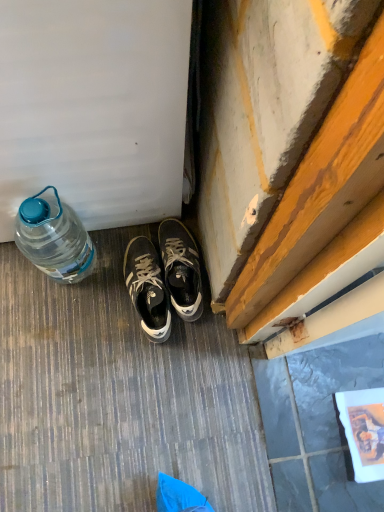
Question: Considering the relative positions of dark gray leather sneakers at center, which appears as the 1th sneakers when viewed from the left, and translucent plastic bottle at left in the image provided, is dark gray leather sneakers at center, which appears as the 1th sneakers when viewed from the left, in front of translucent plastic bottle at left?

Choices:
 (A) yes
 (B) no

Answer: (B)

Question: Considering the relative sizes of dark gray leather sneakers at center, the 2th sneakers when ordered from right to left, and translucent plastic bottle at left in the image provided, is dark gray leather sneakers at center, the 2th sneakers when ordered from right to left, taller than translucent plastic bottle at left?

Choices:
 (A) no
 (B) yes

Answer: (A)

Question: From the image's perspective, is dark gray leather sneakers at center, which appears as the 1th sneakers when viewed from the left, located above translucent plastic bottle at left?

Choices:
 (A) yes
 (B) no

Answer: (B)

Question: Can you confirm if dark gray leather sneakers at center, which appears as the 1th sneakers when viewed from the left, is positioned to the right of translucent plastic bottle at left?

Choices:
 (A) no
 (B) yes

Answer: (B)

Question: From a real-world perspective, is dark gray leather sneakers at center, the 2th sneakers when ordered from right to left, over translucent plastic bottle at left?

Choices:
 (A) yes
 (B) no

Answer: (B)

Question: Considering the relative positions of translucent plastic bottle at left and matte black sneakers at center, positioned as the second sneakers in left-to-right order, in the image provided, is translucent plastic bottle at left behind matte black sneakers at center, positioned as the second sneakers in left-to-right order,?

Choices:
 (A) yes
 (B) no

Answer: (B)

Question: Does translucent plastic bottle at left contain matte black sneakers at center, positioned as the second sneakers in left-to-right order?

Choices:
 (A) no
 (B) yes

Answer: (A)

Question: Is translucent plastic bottle at left closer to the viewer compared to matte black sneakers at center, positioned as the second sneakers in left-to-right order?

Choices:
 (A) no
 (B) yes

Answer: (B)

Question: Is translucent plastic bottle at left thinner than matte black sneakers at center, the first sneakers when ordered from right to left?

Choices:
 (A) yes
 (B) no

Answer: (A)

Question: Is translucent plastic bottle at left taller than matte black sneakers at center, the first sneakers when ordered from right to left?

Choices:
 (A) yes
 (B) no

Answer: (A)

Question: From the image's perspective, would you say translucent plastic bottle at left is positioned over matte black sneakers at center, the first sneakers when ordered from right to left?

Choices:
 (A) yes
 (B) no

Answer: (A)

Question: Considering the relative sizes of translucent plastic bottle at left and dark gray leather sneakers at center, the 2th sneakers when ordered from right to left, in the image provided, is translucent plastic bottle at left smaller than dark gray leather sneakers at center, the 2th sneakers when ordered from right to left,?

Choices:
 (A) no
 (B) yes

Answer: (A)